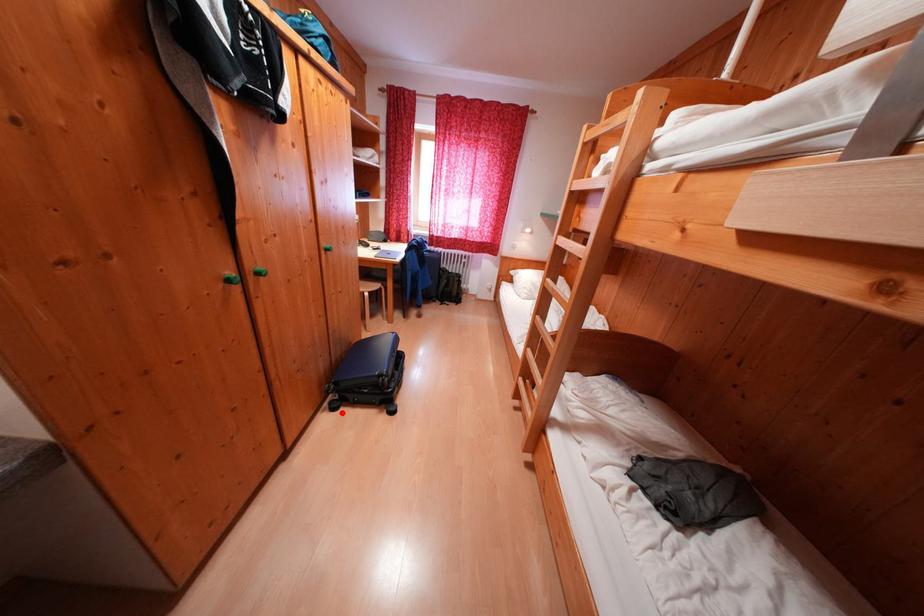
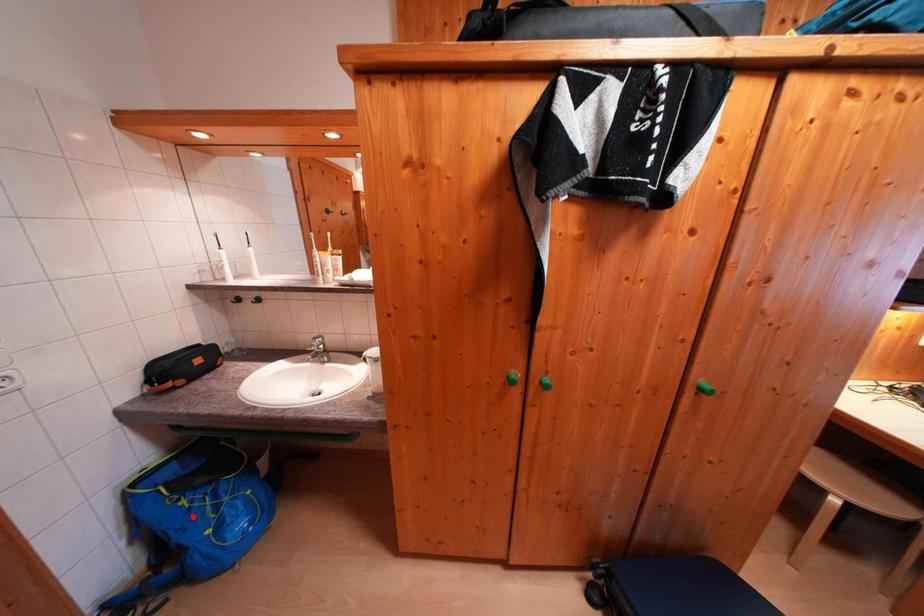
I am providing you with two images of the same scene from different viewpoints. A red point is marked on the first image and another point is marked on the second image. Is the marked point in image1 the same physical position as the marked point in image2?

No